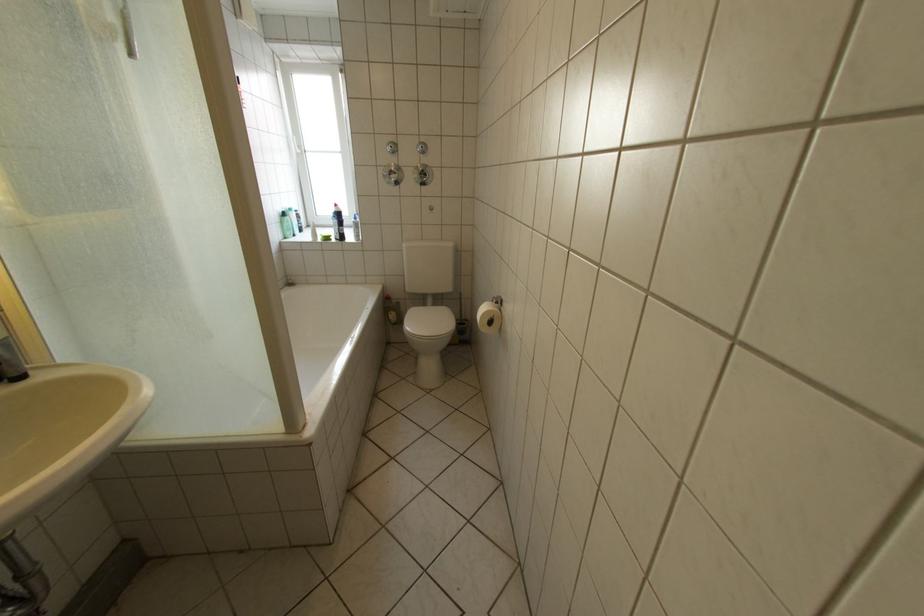
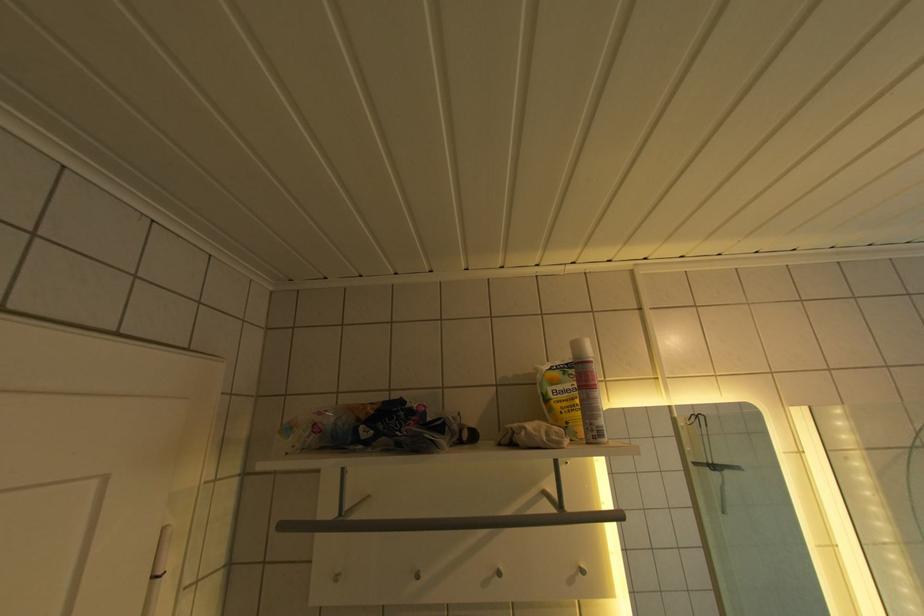
First-person continuous shooting, in which direction is the camera rotating?

The camera's rotation is toward left-up.